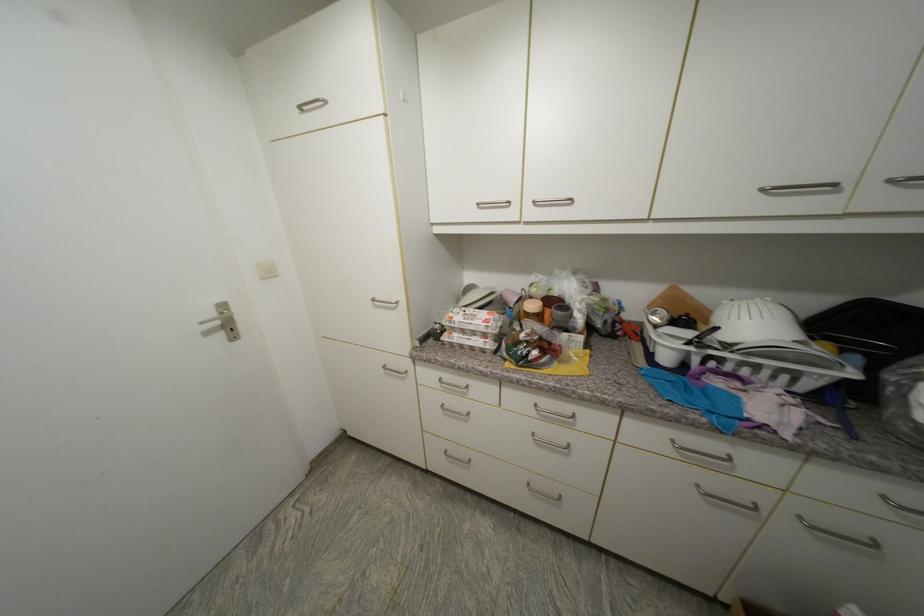
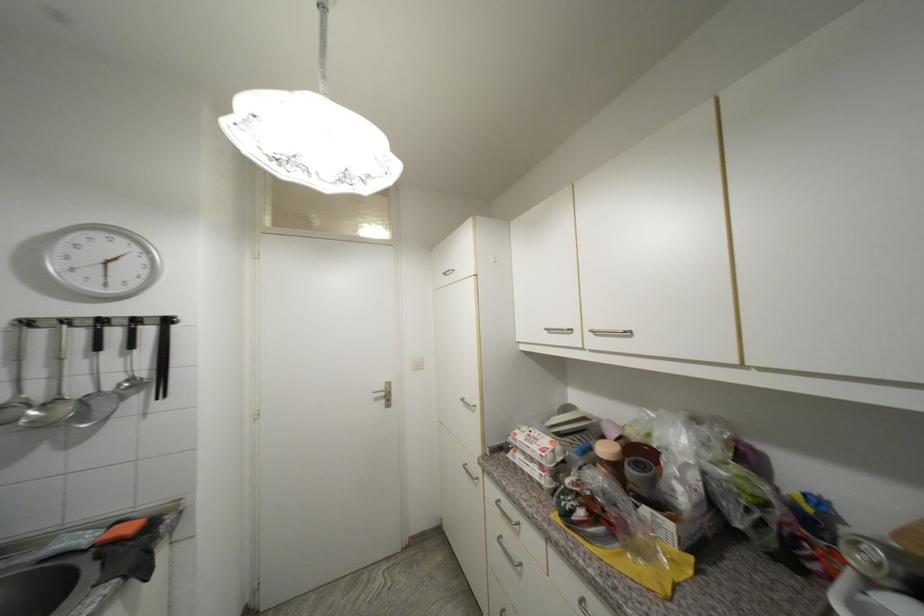
In the second image, find the point that corresponds to point (220, 315) in the first image.

(388, 390)